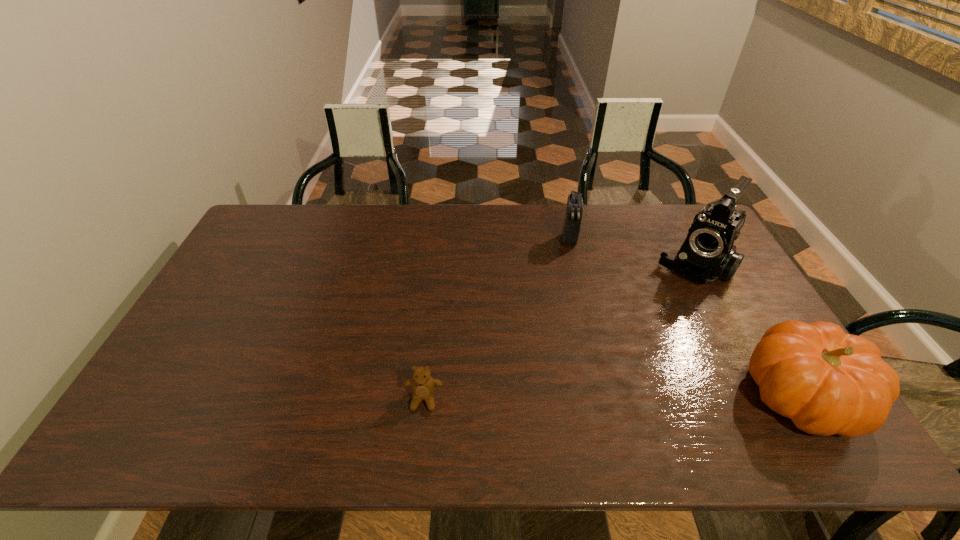
Where is `vacant point located between the pumpkin and the shortest object`? This screenshot has width=960, height=540. vacant point located between the pumpkin and the shortest object is located at coordinates (612, 397).

This screenshot has width=960, height=540. I want to click on empty location between the tallest object and the pumpkin, so click(748, 331).

Identify which object is the second closest to the second shortest object. Please provide its 2D coordinates. Your answer should be formatted as a tuple, i.e. [(x, y)], where the tuple contains the x and y coordinates of a point satisfying the conditions above.

[(827, 382)]

Locate an element on the screen. object that ranks as the second closest to the tallest object is located at coordinates point(827,382).

This screenshot has height=540, width=960. I want to click on vacant space that satisfies the following two spatial constraints: 1. on the front side of the pumpkin; 2. on the left side of the tallest object, so click(x=761, y=395).

Where is `free space that satisfies the following two spatial constraints: 1. on the front side of the tallest object; 2. on the right side of the second shortest object`? This screenshot has width=960, height=540. free space that satisfies the following two spatial constraints: 1. on the front side of the tallest object; 2. on the right side of the second shortest object is located at coordinates (575, 267).